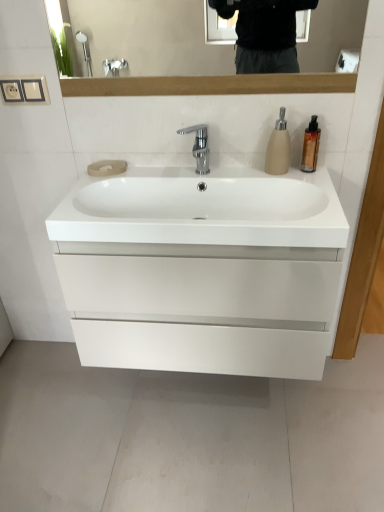
Question: Is gold metallic soap dispenser at upper right, which appears as the 2th soap dispenser when viewed from the left, smaller than polished chrome faucet at center?

Choices:
 (A) no
 (B) yes

Answer: (B)

Question: Is the position of gold metallic soap dispenser at upper right, which is the first soap dispenser from right to left, more distant than that of polished chrome faucet at center?

Choices:
 (A) no
 (B) yes

Answer: (B)

Question: From the image's perspective, is gold metallic soap dispenser at upper right, which is the first soap dispenser from right to left, below polished chrome faucet at center?

Choices:
 (A) yes
 (B) no

Answer: (B)

Question: Does gold metallic soap dispenser at upper right, which is the first soap dispenser from right to left, have a lesser height compared to polished chrome faucet at center?

Choices:
 (A) yes
 (B) no

Answer: (B)

Question: Is gold metallic soap dispenser at upper right, which is the first soap dispenser from right to left, wider than polished chrome faucet at center?

Choices:
 (A) yes
 (B) no

Answer: (B)

Question: Is gold metallic soap dispenser at upper right, which is the first soap dispenser from right to left, inside the boundaries of matte beige soap dispenser at upper right, which ranks as the 1th soap dispenser in left-to-right order, or outside?

Choices:
 (A) inside
 (B) outside

Answer: (B)

Question: Is gold metallic soap dispenser at upper right, which is the first soap dispenser from right to left, taller or shorter than matte beige soap dispenser at upper right, arranged as the second soap dispenser when viewed from the right?

Choices:
 (A) tall
 (B) short

Answer: (B)

Question: In terms of size, does gold metallic soap dispenser at upper right, which appears as the 2th soap dispenser when viewed from the left, appear bigger or smaller than matte beige soap dispenser at upper right, which ranks as the 1th soap dispenser in left-to-right order?

Choices:
 (A) small
 (B) big

Answer: (A)

Question: Visually, is gold metallic soap dispenser at upper right, which appears as the 2th soap dispenser when viewed from the left, positioned to the left or to the right of matte beige soap dispenser at upper right, which ranks as the 1th soap dispenser in left-to-right order?

Choices:
 (A) right
 (B) left

Answer: (A)

Question: In the image, is polished chrome faucet at center on the left side or the right side of matte beige soap dispenser at upper right, arranged as the second soap dispenser when viewed from the right?

Choices:
 (A) right
 (B) left

Answer: (B)

Question: Considering the positions of point tap(193, 151) and point tap(274, 135), is point tap(193, 151) closer or farther from the camera than point tap(274, 135)?

Choices:
 (A) farther
 (B) closer

Answer: (A)

Question: Considering the positions of polished chrome faucet at center and matte beige soap dispenser at upper right, which ranks as the 1th soap dispenser in left-to-right order, in the image, is polished chrome faucet at center taller or shorter than matte beige soap dispenser at upper right, which ranks as the 1th soap dispenser in left-to-right order,?

Choices:
 (A) short
 (B) tall

Answer: (A)

Question: Is polished chrome faucet at center in front of or behind matte beige soap dispenser at upper right, arranged as the second soap dispenser when viewed from the right, in the image?

Choices:
 (A) behind
 (B) front

Answer: (A)

Question: Is point (279, 170) closer or farther from the camera than point (312, 157)?

Choices:
 (A) farther
 (B) closer

Answer: (A)

Question: From a real-world perspective, is matte beige soap dispenser at upper right, arranged as the second soap dispenser when viewed from the right, physically located above or below gold metallic soap dispenser at upper right, which appears as the 2th soap dispenser when viewed from the left?

Choices:
 (A) above
 (B) below

Answer: (A)